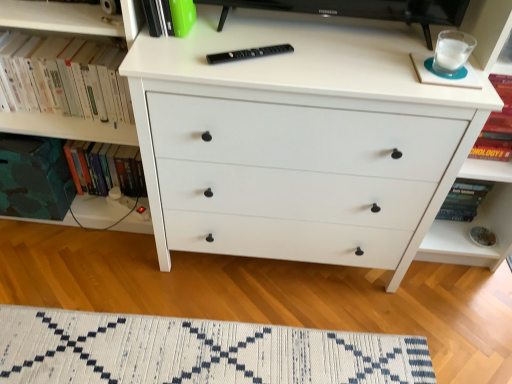
Question: Is hardcover book at left, arranged as the 1th book when viewed from the back, taller than green matte book at upper center, which is counted as the third book, starting from the back?

Choices:
 (A) no
 (B) yes

Answer: (B)

Question: Is hardcover book at left, arranged as the 1th book when viewed from the back, smaller than green matte book at upper center, which is counted as the first book, starting from the front?

Choices:
 (A) yes
 (B) no

Answer: (B)

Question: Is hardcover book at left, arranged as the 1th book when viewed from the back, outside of green matte book at upper center, which is counted as the third book, starting from the back?

Choices:
 (A) no
 (B) yes

Answer: (B)

Question: Does hardcover book at left, arranged as the 1th book when viewed from the back, have a lesser width compared to green matte book at upper center, which is counted as the third book, starting from the back?

Choices:
 (A) no
 (B) yes

Answer: (A)

Question: Can you confirm if hardcover book at left, arranged as the 1th book when viewed from the back, is positioned to the right of green matte book at upper center, which is counted as the first book, starting from the front?

Choices:
 (A) yes
 (B) no

Answer: (B)

Question: Would you say green matte book at upper center, which is counted as the first book, starting from the front, is part of hardcover book at left, arranged as the 1th book when viewed from the back,'s contents?

Choices:
 (A) yes
 (B) no

Answer: (B)

Question: Does white matte chest of drawers at center have a smaller size compared to white woven mat at lower center?

Choices:
 (A) no
 (B) yes

Answer: (A)

Question: Is white matte chest of drawers at center at the left side of white woven mat at lower center?

Choices:
 (A) yes
 (B) no

Answer: (B)

Question: Is white matte chest of drawers at center not within white woven mat at lower center?

Choices:
 (A) no
 (B) yes

Answer: (B)

Question: Is the position of white matte chest of drawers at center less distant than that of white woven mat at lower center?

Choices:
 (A) yes
 (B) no

Answer: (A)

Question: Is white matte chest of drawers at center looking in the opposite direction of white woven mat at lower center?

Choices:
 (A) yes
 (B) no

Answer: (B)

Question: Is white woven mat at lower center located within white matte chest of drawers at center?

Choices:
 (A) no
 (B) yes

Answer: (A)

Question: Can you confirm if white woven mat at lower center is wider than white matte chest of drawers at center?

Choices:
 (A) yes
 (B) no

Answer: (B)